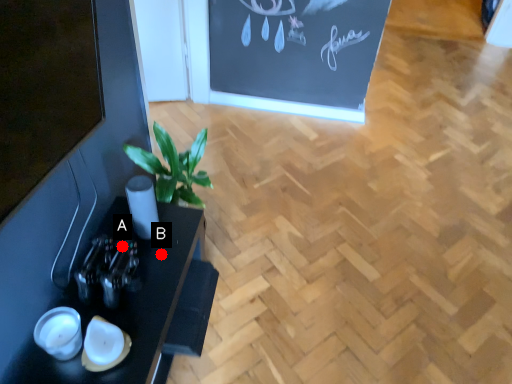
Question: Two points are circled on the image, labeled by A and B beside each circle. Which point is farther from the camera taking this photo?

Choices:
 (A) A is further
 (B) B is further

Answer: (B)